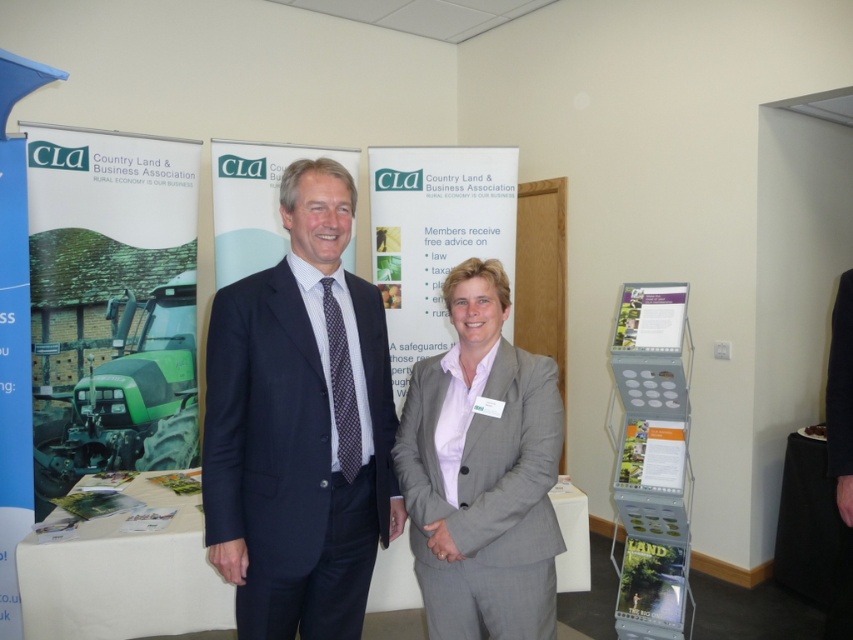
You are an event photographer who needs to adjust the lighting to ensure both the matte black suit at center and the matte paper poster at lower right are well lit. Since the poster is reflective, you want to avoid glare. Which object should you adjust the light first to prevent glare, and why?

You should adjust the lighting for the matte paper poster at lower right first because it is reflective and positioned on the right side of the matte black suit at center. By addressing the poster first, you can ensure that its reflective surface doesn

You are organizing a photo shoot and need to ensure that all elements in the frame are visible. Given the dark blue suit at center and the matte paper poster at lower right, which object would require more space in the composition to maintain clarity?

The dark blue suit at center requires more space in the composition because it has a larger size compared to the matte paper poster at lower right.